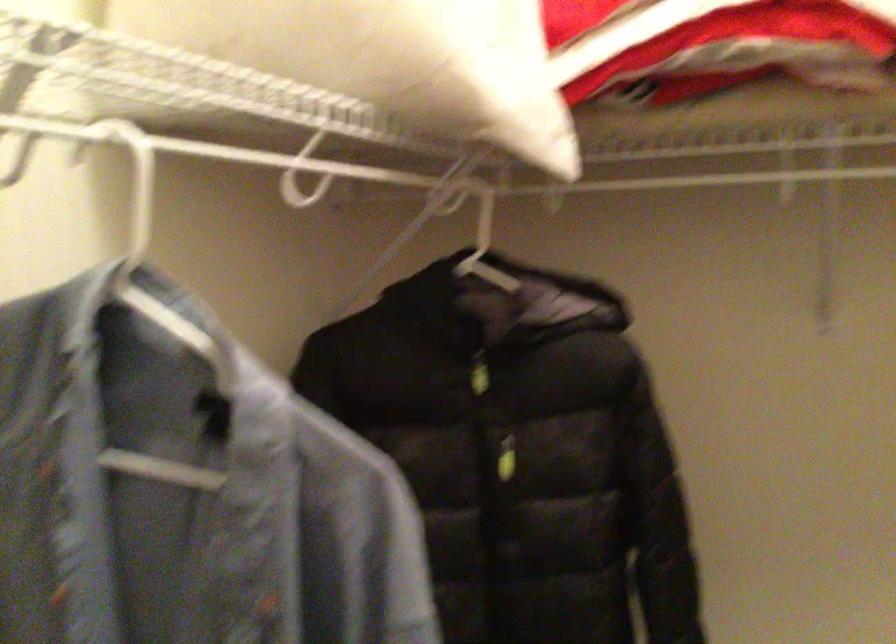
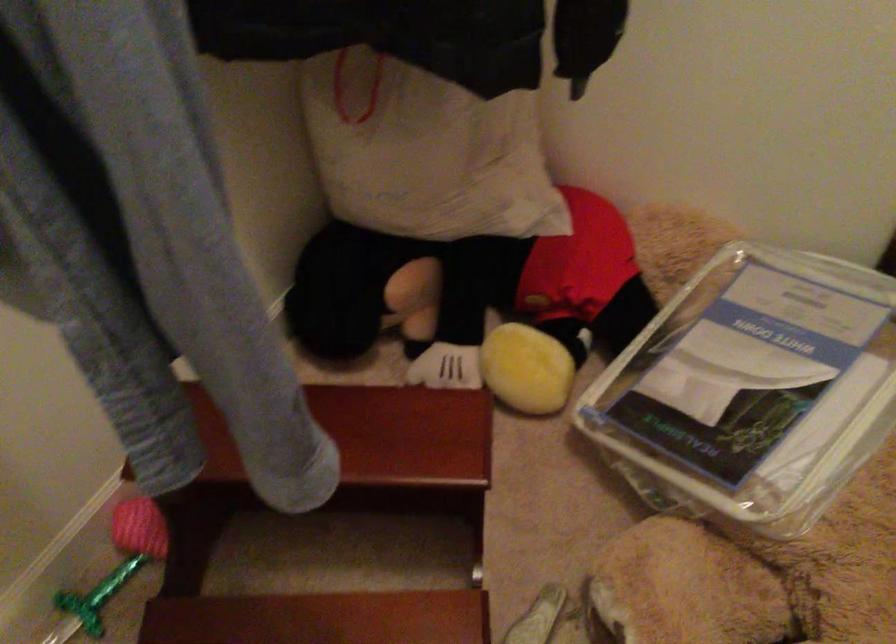
Question: How did the camera likely rotate?

Choices:
 (A) Left
 (B) Right
 (C) Up
 (D) Down

Answer: (D)